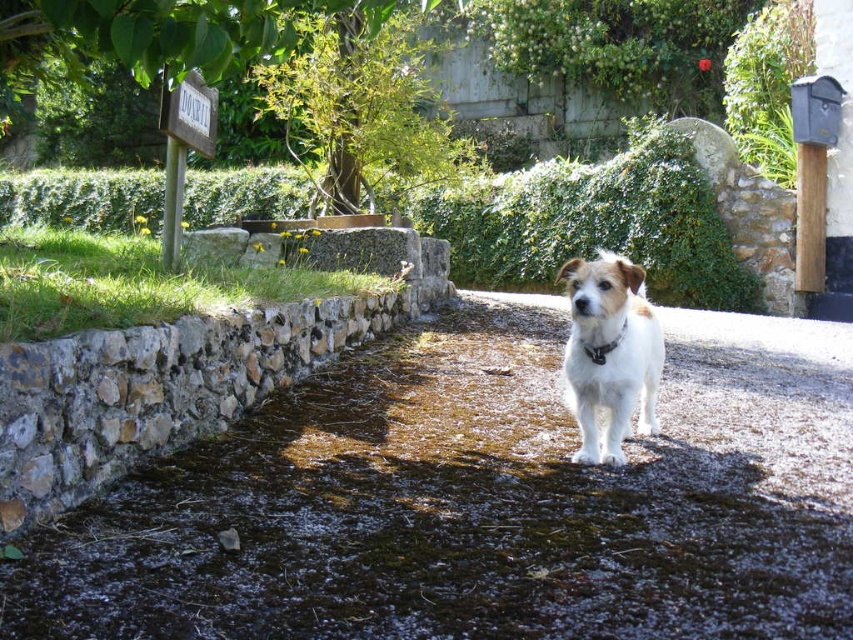
You are a photographer trying to capture the entire brown stone path at center and the black leather neckband at center in one frame. Which object will occupy more space in your photo?

The brown stone path at center will occupy more space in the photo since it has a larger size compared to the black leather neckband at center.